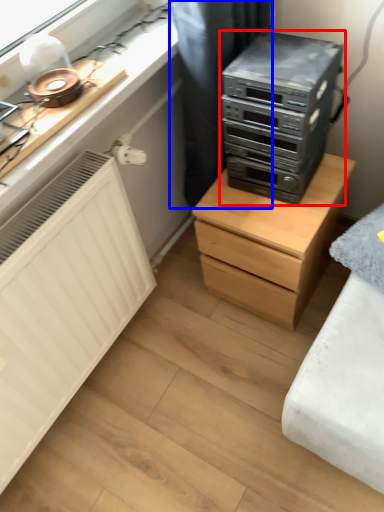
Question: Which point is closer to the camera, home appliance (highlighted by a red box) or curtain (highlighted by a blue box)?

Choices:
 (A) home appliance
 (B) curtain

Answer: (A)